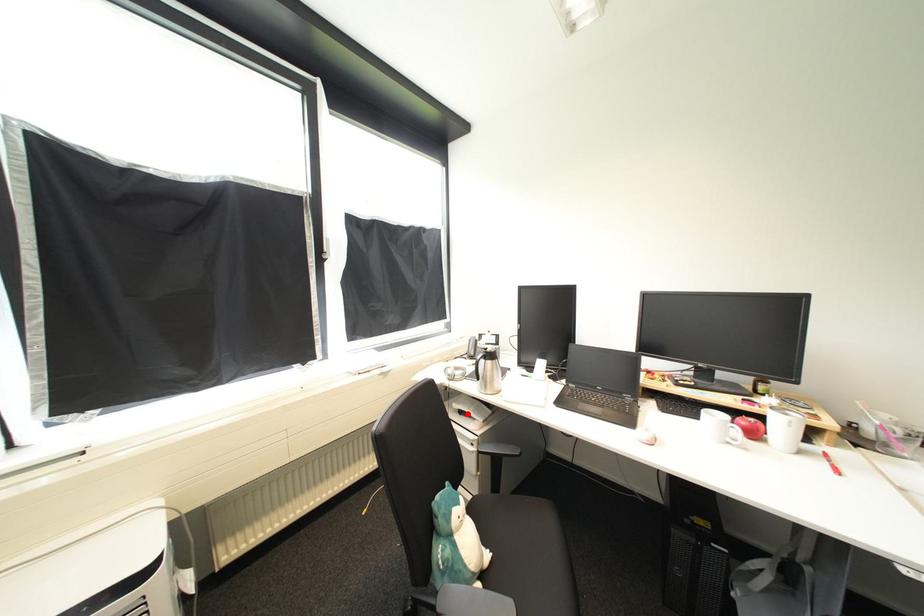
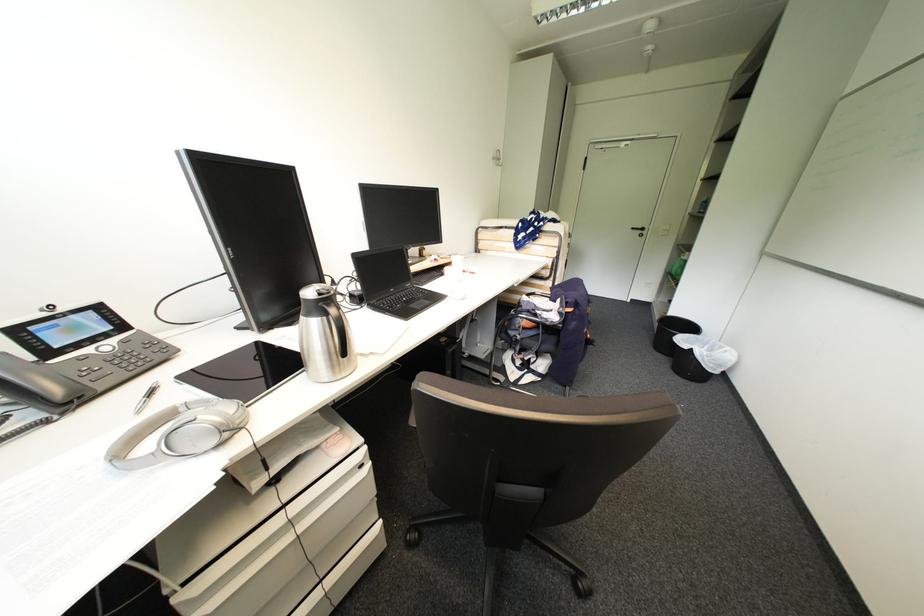
Locate, in the second image, the point that corresponds to the highlighted location in the first image.

(283, 480)